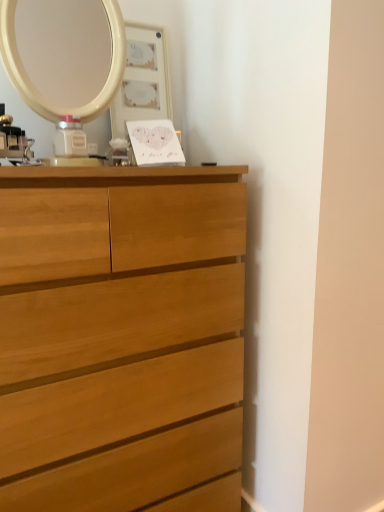
Locate an element on the screen. light brown wood chest of drawers at center is located at coordinates (121, 338).

Describe the element at coordinates (121, 338) in the screenshot. The height and width of the screenshot is (512, 384). I see `light brown wood chest of drawers at center` at that location.

In the scene shown: What is the approximate width of light brown wood chest of drawers at center?

20.36 inches.

Identify the location of light brown wood chest of drawers at center. The width and height of the screenshot is (384, 512). (121, 338).